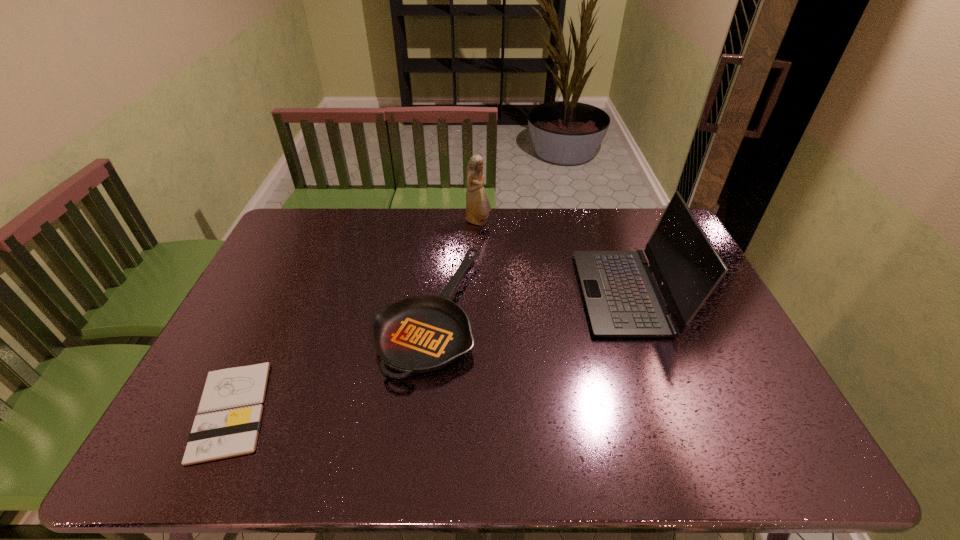
Identify the location of the farthest object. (478, 207).

Identify the location of the rightmost object. click(x=622, y=298).

Image resolution: width=960 pixels, height=540 pixels. What are the coordinates of `frying pan` in the screenshot? It's located at click(419, 334).

Identify the location of notepad. Image resolution: width=960 pixels, height=540 pixels. (230, 409).

Image resolution: width=960 pixels, height=540 pixels. Identify the location of the shortest object. (230, 409).

At what (x,y) coordinates should I click in order to perform the action: click on vacant space positioned 0.170m on the front-facing side of the figurine. Please return your answer as a coordinate pair (x, y). This screenshot has height=540, width=960. Looking at the image, I should click on (537, 222).

Where is `vacant position located 0.060m on the screen of the laptop computer`? vacant position located 0.060m on the screen of the laptop computer is located at coordinates (563, 293).

Locate an element on the screen. vacant area located 0.090m on the screen of the laptop computer is located at coordinates (552, 293).

The width and height of the screenshot is (960, 540). Find the location of `vacant region located on the screen of the laptop computer`. vacant region located on the screen of the laptop computer is located at coordinates (546, 293).

The width and height of the screenshot is (960, 540). Find the location of `vacant space located on the right of the second shortest object`. vacant space located on the right of the second shortest object is located at coordinates (581, 313).